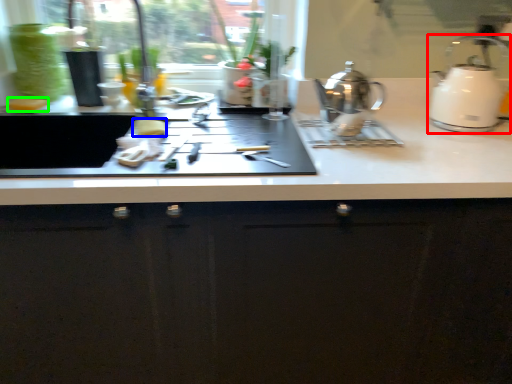
Question: Considering the real-world distances, which object is closest to kettle (highlighted by a red box)? food (highlighted by a blue box) or food (highlighted by a green box).

Choices:
 (A) food
 (B) food

Answer: (A)